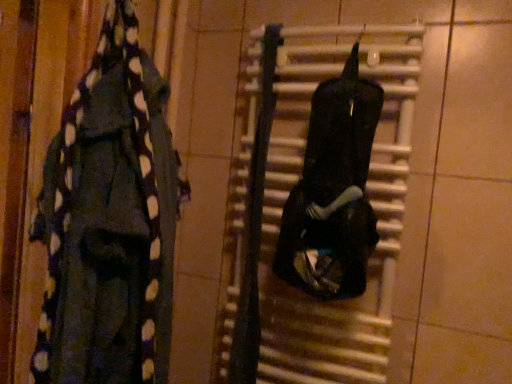
In order to click on black polka dot scarf at left, positioned as the first clothing in left-to-right order in this screenshot , I will do `click(110, 221)`.

Could you tell me if black matte radiator at center is turned towards black matte backpack at center, the second clothing from the left?

Yes, black matte radiator at center faces towards black matte backpack at center, the second clothing from the left.

From the image's perspective, is black matte radiator at center over black matte backpack at center, the second clothing from the left?

Incorrect, from the image's perspective, black matte radiator at center is lower than black matte backpack at center, the second clothing from the left.

Do you think black matte radiator at center is within black matte backpack at center, the 1th clothing viewed from the right, or outside of it?

black matte radiator at center is outside black matte backpack at center, the 1th clothing viewed from the right.

What's the angular difference between black matte radiator at center and black matte backpack at center, the 1th clothing viewed from the right,'s facing directions?

The angular difference between black matte radiator at center and black matte backpack at center, the 1th clothing viewed from the right, is 0.000191 degrees.

Does point (168, 352) lie in front of point (311, 178)?

That is True.

Considering the sizes of objects black polka dot scarf at left, positioned as the first clothing in left-to-right order, and black matte backpack at center, the 1th clothing viewed from the right, in the image provided, who is bigger, black polka dot scarf at left, positioned as the first clothing in left-to-right order, or black matte backpack at center, the 1th clothing viewed from the right,?

black polka dot scarf at left, positioned as the first clothing in left-to-right order.

Is black polka dot scarf at left, which ranks as the 2th clothing in right-to-left order, positioned beyond the bounds of black matte backpack at center, the second clothing from the left?

black polka dot scarf at left, which ranks as the 2th clothing in right-to-left order, lies outside black matte backpack at center, the second clothing from the left,'s area.

Are black polka dot scarf at left, positioned as the first clothing in left-to-right order, and black matte backpack at center, the second clothing from the left, beside each other?

black polka dot scarf at left, positioned as the first clothing in left-to-right order, and black matte backpack at center, the second clothing from the left, are not in contact.

Does black polka dot scarf at left, positioned as the first clothing in left-to-right order, turn towards black matte radiator at center?

No, black polka dot scarf at left, positioned as the first clothing in left-to-right order, does not turn towards black matte radiator at center.

Is black matte radiator at center surrounded by black polka dot scarf at left, positioned as the first clothing in left-to-right order?

No, black matte radiator at center is not a part of black polka dot scarf at left, positioned as the first clothing in left-to-right order.

From a real-world perspective, between black polka dot scarf at left, which ranks as the 2th clothing in right-to-left order, and black matte radiator at center, who is vertically higher?

In real-world perspective, black polka dot scarf at left, which ranks as the 2th clothing in right-to-left order, is above.

Which of these two, black matte backpack at center, the second clothing from the left, or black matte radiator at center, is smaller?

black matte backpack at center, the second clothing from the left, is smaller.

Measure the distance from black matte backpack at center, the second clothing from the left, to black matte radiator at center.

4.90 inches.

How many degrees apart are the facing directions of black matte backpack at center, the second clothing from the left, and black matte radiator at center?

black matte backpack at center, the second clothing from the left, and black matte radiator at center are facing 0.000191 degrees away from each other.

This screenshot has height=384, width=512. Find the location of `radiator located on the left of black matte backpack at center, the second clothing from the left`. radiator located on the left of black matte backpack at center, the second clothing from the left is located at coordinates (287, 195).

From a real-world perspective, is black matte radiator at center beneath black polka dot scarf at left, which ranks as the 2th clothing in right-to-left order?

Yes, from a real-world perspective, black matte radiator at center is below black polka dot scarf at left, which ranks as the 2th clothing in right-to-left order.

Considering the relative sizes of black matte radiator at center and black polka dot scarf at left, which ranks as the 2th clothing in right-to-left order, in the image provided, is black matte radiator at center smaller than black polka dot scarf at left, which ranks as the 2th clothing in right-to-left order,?

Yes, black matte radiator at center is smaller than black polka dot scarf at left, which ranks as the 2th clothing in right-to-left order.

How much distance is there between black matte radiator at center and black polka dot scarf at left, positioned as the first clothing in left-to-right order?

The distance of black matte radiator at center from black polka dot scarf at left, positioned as the first clothing in left-to-right order, is 34.37 centimeters.

Between point (387, 71) and point (138, 64), which one is positioned in front?

Point (138, 64)

From a real-world perspective, which is physically above, black matte backpack at center, the 1th clothing viewed from the right, or black polka dot scarf at left, positioned as the first clothing in left-to-right order?

black matte backpack at center, the 1th clothing viewed from the right, is physically above.

From the image's perspective, is black matte backpack at center, the 1th clothing viewed from the right, over black polka dot scarf at left, which ranks as the 2th clothing in right-to-left order?

Yes, from the image's perspective, black matte backpack at center, the 1th clothing viewed from the right, is above black polka dot scarf at left, which ranks as the 2th clothing in right-to-left order.

Can you confirm if black matte backpack at center, the 1th clothing viewed from the right, is taller than black polka dot scarf at left, which ranks as the 2th clothing in right-to-left order?

In fact, black matte backpack at center, the 1th clothing viewed from the right, may be shorter than black polka dot scarf at left, which ranks as the 2th clothing in right-to-left order.

Find the location of a particular element. This screenshot has width=512, height=384. radiator on the left side of black matte backpack at center, the second clothing from the left is located at coordinates (287, 195).

You are a GUI agent. You are given a task and a screenshot of the screen. Output one action in this format:
    pyautogui.click(x=<x>, y=<y>)
    Task: Click on the clothing that is in front of the black matte backpack at center, the 1th clothing viewed from the right
    The height and width of the screenshot is (384, 512).
    Given the screenshot: What is the action you would take?
    pyautogui.click(x=110, y=221)

Looking at the image, which one is located further to black polka dot scarf at left, which ranks as the 2th clothing in right-to-left order, black matte backpack at center, the second clothing from the left, or black matte radiator at center?

black matte backpack at center, the second clothing from the left, is positioned further to the anchor black polka dot scarf at left, which ranks as the 2th clothing in right-to-left order.

When comparing their distances from black matte backpack at center, the 1th clothing viewed from the right, does black matte radiator at center or black polka dot scarf at left, which ranks as the 2th clothing in right-to-left order, seem further?

black polka dot scarf at left, which ranks as the 2th clothing in right-to-left order, is further to black matte backpack at center, the 1th clothing viewed from the right.

Based on their spatial positions, is black polka dot scarf at left, positioned as the first clothing in left-to-right order, or black matte backpack at center, the second clothing from the left, closer to black matte radiator at center?

black matte backpack at center, the second clothing from the left, is positioned closer to the anchor black matte radiator at center.

Consider the image. Considering their positions, is black matte backpack at center, the 1th clothing viewed from the right, positioned further to black matte radiator at center than black polka dot scarf at left, which ranks as the 2th clothing in right-to-left order?

Based on the image, black polka dot scarf at left, which ranks as the 2th clothing in right-to-left order, appears to be further to black matte radiator at center.

Which object lies further to the anchor point black matte backpack at center, the 1th clothing viewed from the right, black polka dot scarf at left, positioned as the first clothing in left-to-right order, or black matte radiator at center?

black polka dot scarf at left, positioned as the first clothing in left-to-right order, lies further to black matte backpack at center, the 1th clothing viewed from the right, than the other object.

Considering their positions, is black matte radiator at center positioned further to black polka dot scarf at left, which ranks as the 2th clothing in right-to-left order, than black matte backpack at center, the second clothing from the left?

Based on the image, black matte backpack at center, the second clothing from the left, appears to be further to black polka dot scarf at left, which ranks as the 2th clothing in right-to-left order.

Where is `radiator between black polka dot scarf at left, which ranks as the 2th clothing in right-to-left order, and black matte backpack at center, the 1th clothing viewed from the right`? radiator between black polka dot scarf at left, which ranks as the 2th clothing in right-to-left order, and black matte backpack at center, the 1th clothing viewed from the right is located at coordinates (287, 195).